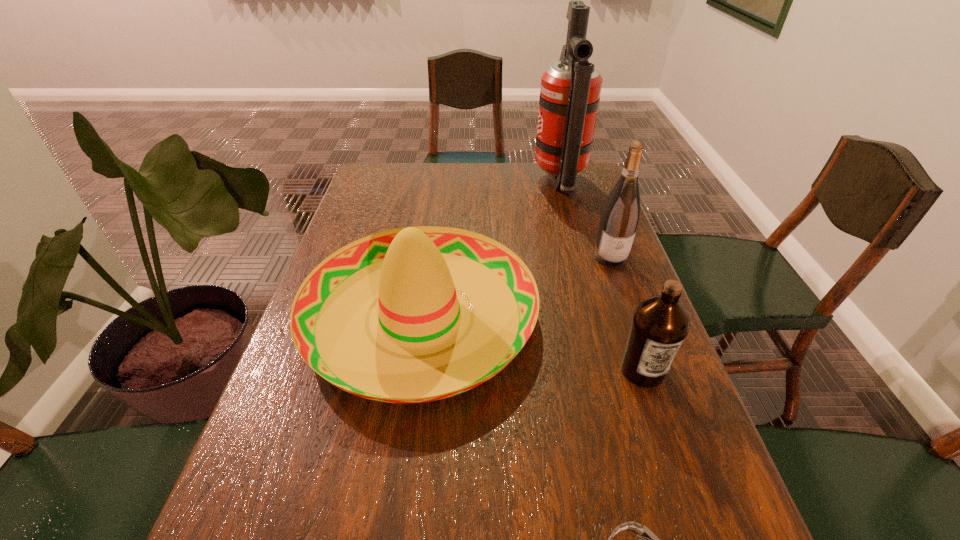
In order to click on vacant space located 0.050m on the label of the olive oil in this screenshot , I will do `click(657, 413)`.

This screenshot has width=960, height=540. I want to click on object positioned at the far edge, so click(570, 91).

You are a GUI agent. You are given a task and a screenshot of the screen. Output one action in this format:
    pyautogui.click(x=<x>, y=<y>)
    Task: Click on the object located at the left edge
    Image resolution: width=960 pixels, height=540 pixels.
    Given the screenshot: What is the action you would take?
    pyautogui.click(x=421, y=342)

You are a GUI agent. You are given a task and a screenshot of the screen. Output one action in this format:
    pyautogui.click(x=<x>, y=<y>)
    Task: Click on the fire extinguisher positioned at the right edge
    The image size is (960, 540).
    Given the screenshot: What is the action you would take?
    pyautogui.click(x=570, y=91)

Identify the location of wine bottle that is at the right edge. (620, 216).

Identify the location of olive oil situated at the right edge. (660, 324).

Identify the location of object located in the far right corner section of the desktop. (570, 91).

Locate an element on the screen. This screenshot has height=540, width=960. vacant space at the far edge is located at coordinates (539, 169).

The image size is (960, 540). I want to click on vacant position at the left edge of the desktop, so click(274, 490).

Image resolution: width=960 pixels, height=540 pixels. I want to click on blank area at the far left corner, so click(404, 173).